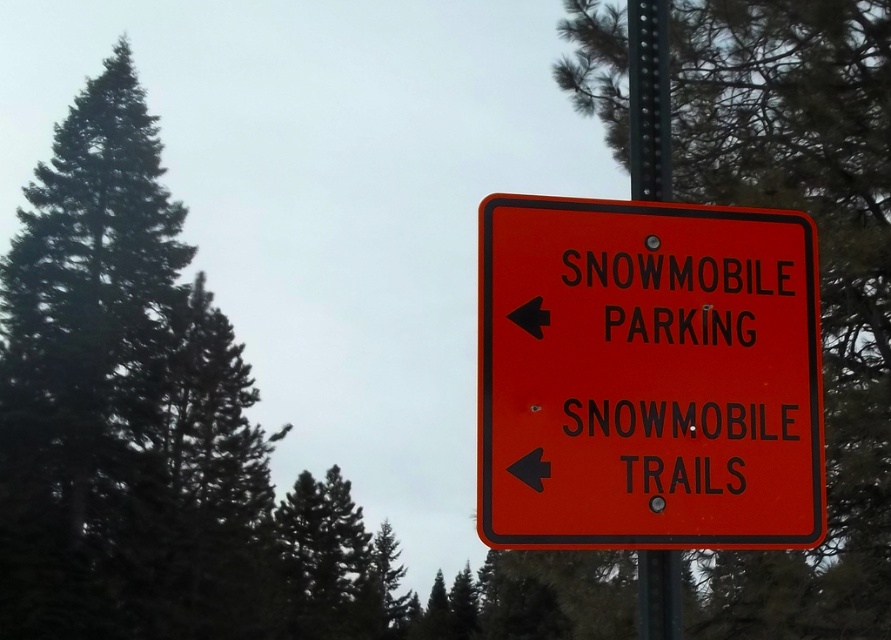
Does point (605, 246) lie behind point (677, 593)?

Yes.

Between orange plastic sign at center and metallic pole at center, which one appears on the left side from the viewer's perspective?

Positioned to the left is orange plastic sign at center.

Identify the location of orange plastic sign at center. The width and height of the screenshot is (891, 640). (647, 376).

Is green textured pine tree at upper right below metallic pole at center?

No.

Can you confirm if green textured pine tree at upper right is taller than metallic pole at center?

Correct, green textured pine tree at upper right is much taller as metallic pole at center.

Measure the distance between green textured pine tree at upper right and camera.

green textured pine tree at upper right and camera are 7.18 meters apart.

Find the location of a particular element. green textured pine tree at upper right is located at coordinates (819, 273).

Is point (627, 204) farther from camera compared to point (860, 365)?

That is False.

Is orange plastic sign at center taller than green textured pine tree at upper right?

No.

This screenshot has height=640, width=891. I want to click on orange plastic sign at center, so click(647, 376).

You are a GUI agent. You are given a task and a screenshot of the screen. Output one action in this format:
    pyautogui.click(x=<x>, y=<y>)
    Task: Click on the orange plastic sign at center
    The image size is (891, 640).
    Given the screenshot: What is the action you would take?
    pyautogui.click(x=647, y=376)